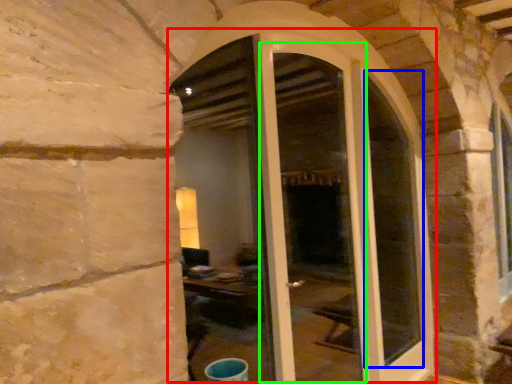
Question: Which is nearer to the door (highlighted by a red box)? glass window (highlighted by a blue box) or screen door (highlighted by a green box).

Choices:
 (A) glass window
 (B) screen door

Answer: (A)